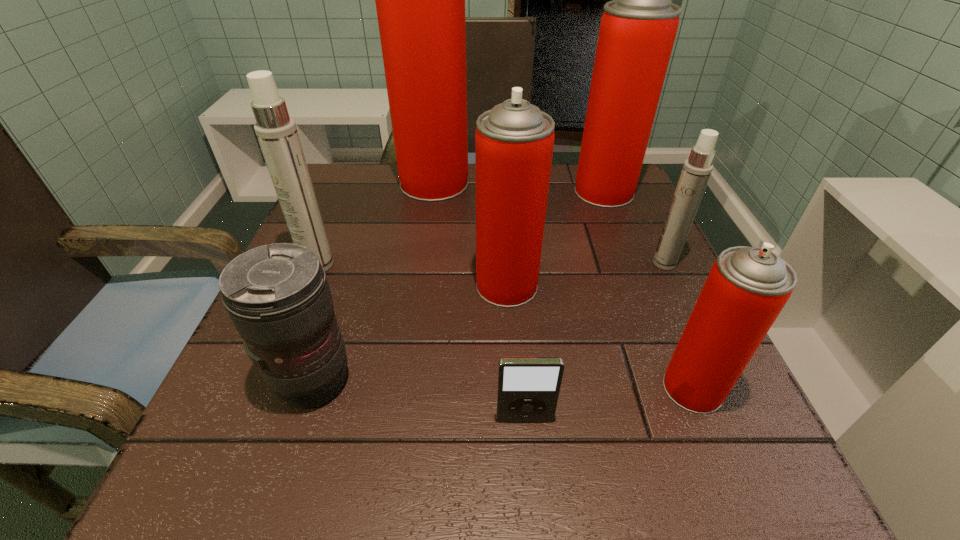
Image resolution: width=960 pixels, height=540 pixels. I want to click on vacant region located on the front-facing side of the shortest object, so click(530, 482).

I want to click on aerosol can at the left edge, so click(277, 133).

You are a GUI agent. You are given a task and a screenshot of the screen. Output one action in this format:
    pyautogui.click(x=<x>, y=<y>)
    Task: Click on the telephoto lens that is at the left edge
    This screenshot has width=960, height=540.
    Given the screenshot: What is the action you would take?
    pyautogui.click(x=278, y=297)

Where is `object at the far right corner`? The height and width of the screenshot is (540, 960). object at the far right corner is located at coordinates (637, 31).

The height and width of the screenshot is (540, 960). I want to click on vacant space at the far edge, so click(x=557, y=172).

Locate an element on the screen. This screenshot has height=540, width=960. free space at the near edge is located at coordinates (363, 460).

Find the location of a particular element. The height and width of the screenshot is (540, 960). vacant space at the left edge is located at coordinates (213, 415).

This screenshot has height=540, width=960. What are the coordinates of `vacant space at the right edge of the desktop` in the screenshot? It's located at pos(619,299).

You are a GUI agent. You are given a task and a screenshot of the screen. Output one action in this format:
    pyautogui.click(x=<x>, y=<y>)
    Task: Click on the vacant space at the far left corner of the desktop
    
    Given the screenshot: What is the action you would take?
    pyautogui.click(x=349, y=214)

The image size is (960, 540). Find the location of `vacant space at the near left corner of the desktop`. vacant space at the near left corner of the desktop is located at coordinates (283, 477).